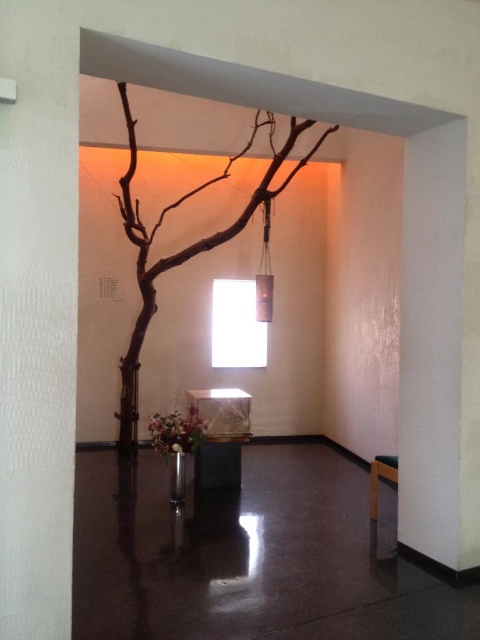
Can you confirm if white glossy vase at center is positioned to the left of wooden bench at lower right?

Yes, white glossy vase at center is to the left of wooden bench at lower right.

Is white glossy vase at center bigger than wooden bench at lower right?

Indeed, white glossy vase at center has a larger size compared to wooden bench at lower right.

Is point (192, 442) closer to camera compared to point (375, 516)?

No, (192, 442) is behind (375, 516).

The image size is (480, 640). I want to click on white glossy vase at center, so click(177, 432).

Identify the location of brown matte tree at center. The image size is (480, 640). (187, 246).

In the scene shown: Who is more forward, (224, 234) or (163, 428)?

Point (163, 428) is in front.

Who is more distant from viewer, (139, 355) or (197, 440)?

Point (139, 355)

Locate an element on the screen. brown matte tree at center is located at coordinates (187, 246).

Locate an element on the screen. Image resolution: width=480 pixels, height=640 pixels. brown matte tree at center is located at coordinates (187, 246).

Locate an element on the screen. The image size is (480, 640). brown matte tree at center is located at coordinates (187, 246).